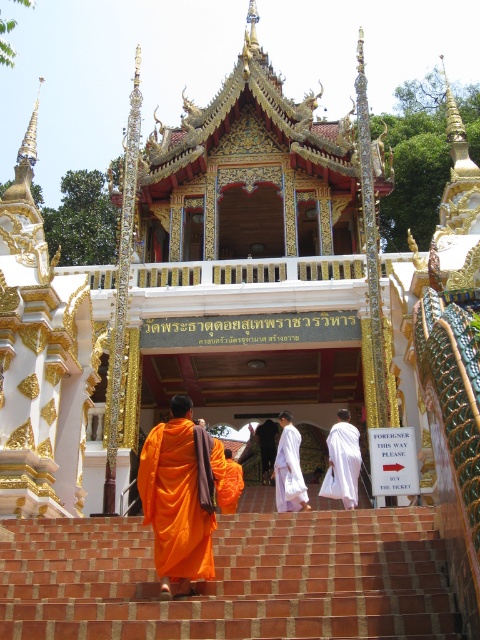
You are a visitor approaching the entrance of the temple and see the terracotta brick stairs at center and the orange cloth at center. Which object is positioned to the left of the other?

The orange cloth at center is to the left of the terracotta brick stairs at center because the stairs are to the right of the orange cloth.

You are a visitor approaching the entrance of the temple. You see the terracotta brick stairs at center and the white silk robe at center. Which object is closer to you as you approach the temple entrance?

The terracotta brick stairs at center is closer to you because it is in front of the white silk robe at center.

You are a visitor at the temple entrance and want to place a small offering on the orange cloth at center. Based on its coordinates, where exactly should you aim to place the offering?

The orange cloth at center is located at coordinates point [175,502], so you should aim to place the offering precisely at that coordinate point.